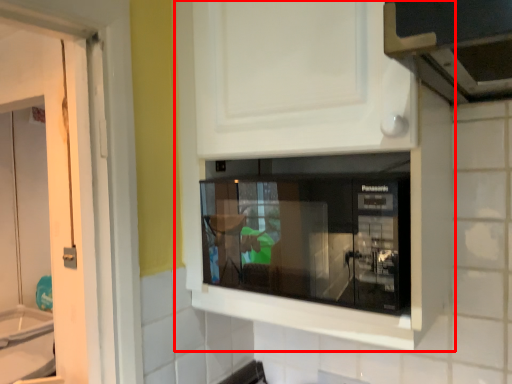
Question: From the image, what is the correct spatial relationship of cabinetry (annotated by the red box) in relation to microwave oven?

Choices:
 (A) right
 (B) left

Answer: (A)